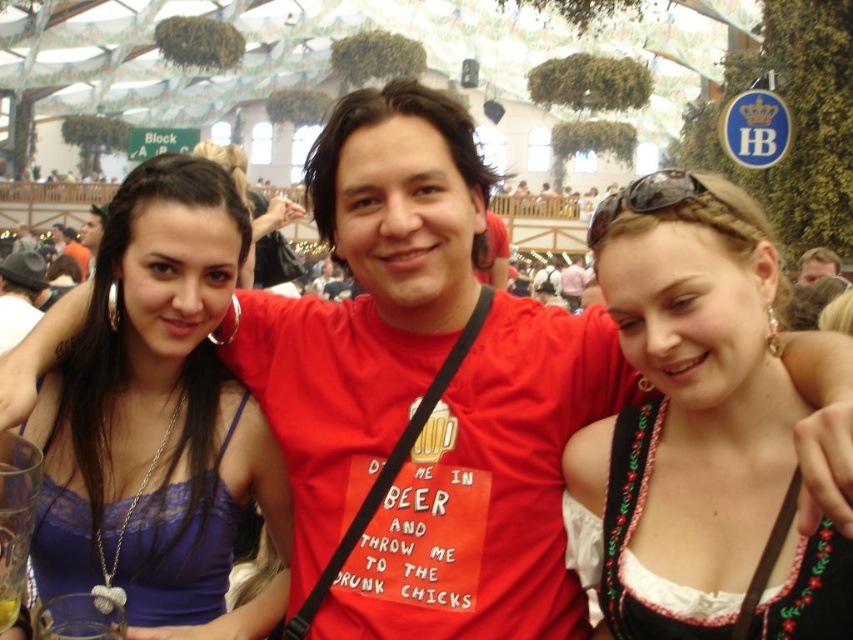
You are organizing a costume party and need to decide which item to place on a shelf that can only hold items up to 30 cm in width. You have the lace fabric top at left and the matte black sunglasses at upper center. Based on their widths, which item can definitely fit on the shelf?

The lace fabric top at left might be wider than matte black sunglasses at upper center, so the matte black sunglasses at upper center can definitely fit on the shelf since it is narrower than 30 cm.

You are at the festival and want to take a photo with the person wearing the white embroidered dirndl at center and the smooth brown leather jacket at upper center. To ensure both are in the frame, should you position yourself to the left or right of them?

You should position yourself to the right of the white embroidered dirndl at center and the smooth brown leather jacket at upper center because the white embroidered dirndl at center is to the left of the smooth brown leather jacket at upper center, so placing yourself to the right would capture both in the frame.

You are a photographer at the event and want to take a picture of the white embroidered dirndl at center and the smooth brown leather jacket at upper center. Which object should you focus on first if you want to capture both in one frame without moving the camera?

The white embroidered dirndl at center is much taller than the smooth brown leather jacket at upper center, so you should focus on the white embroidered dirndl at center first to ensure it fits within the frame.